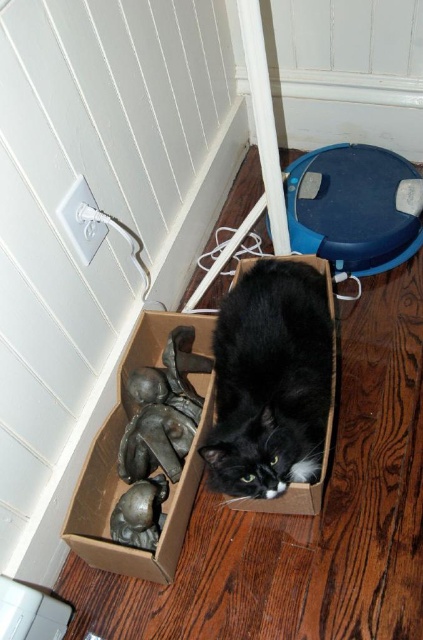
Question: Among these objects, which one is nearest to the camera?

Choices:
 (A) brown cardboard box at lower center
 (B) black soft fur cat at center

Answer: (B)

Question: Which of the following is the farthest from the observer?

Choices:
 (A) brown cardboard box at lower center
 (B) black soft fur cat at center

Answer: (A)

Question: Where is black soft fur cat at center located in relation to brown cardboard box at lower center in the image?

Choices:
 (A) above
 (B) below

Answer: (A)

Question: Is black soft fur cat at center bigger than brown cardboard box at lower center?

Choices:
 (A) no
 (B) yes

Answer: (A)

Question: Which point is farther to the camera?

Choices:
 (A) 85,500
 (B) 244,328

Answer: (B)

Question: From the image, what is the correct spatial relationship of black soft fur cat at center in relation to brown cardboard box at lower center?

Choices:
 (A) right
 (B) left

Answer: (A)